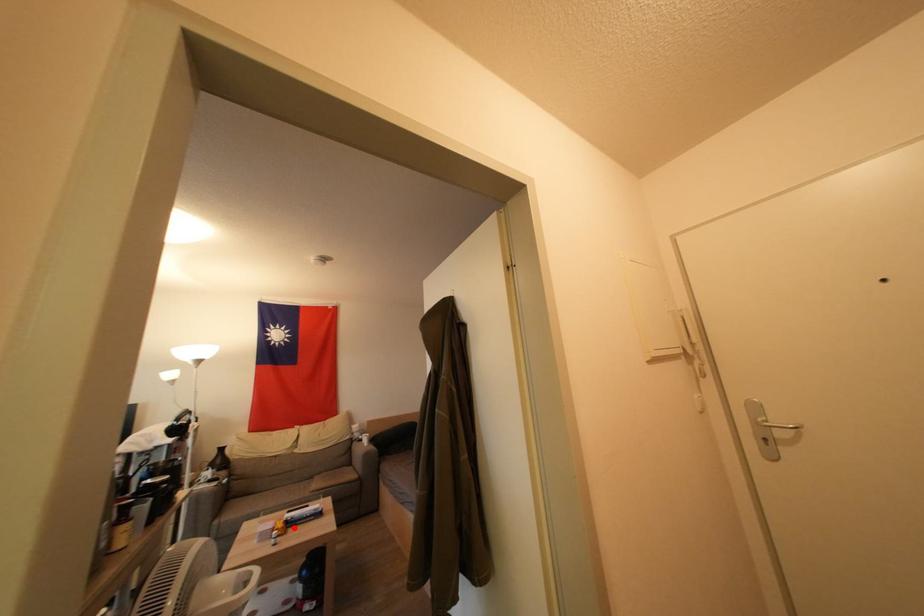
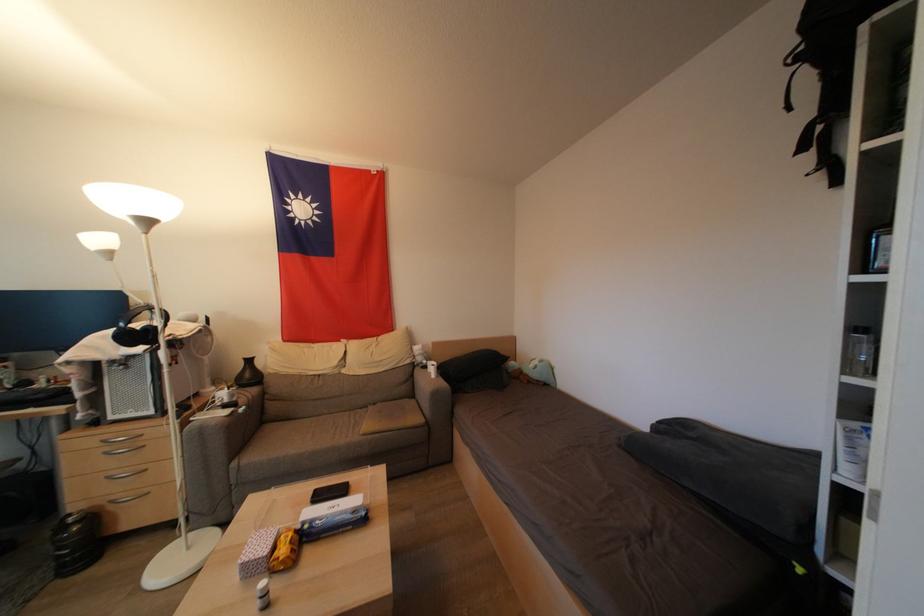
In the second image, find the point that corresponds to the highlighted location in the first image.

(310, 541)